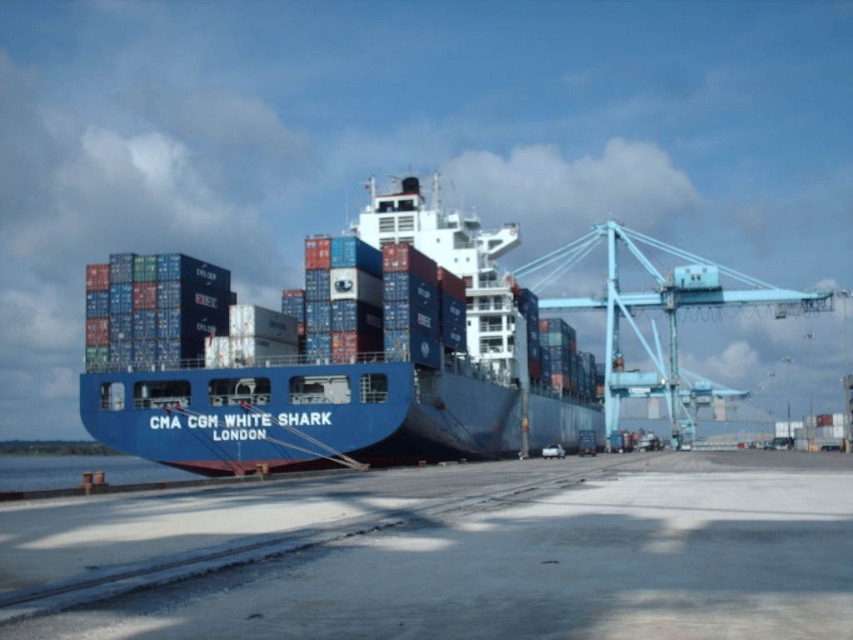
You are a crane operator tasked with loading containers onto the blue matte container ship at center and the blue water at lower left. Which object requires a crane with a narrower reach?

The blue matte container ship at center requires a crane with a narrower reach because it is thinner than the blue water at lower left.

You are a dock worker standing on the quay and need to secure the blue matte container ship at center to the blue metallic crane at right. Based on their positions, can you safely attach the crane to the ship?

The blue matte container ship at center is located above the blue metallic crane at right, so the crane can safely reach and attach to the ship.

You are a crane operator on the blue metallic crane at right. You need to lower a shipping container into the blue water at lower left. Is the crane positioned in a way that allows you to safely lower the container into the water?

The blue metallic crane at right is positioned over the blue water at lower left, so yes, the crane can safely lower the container into the water.